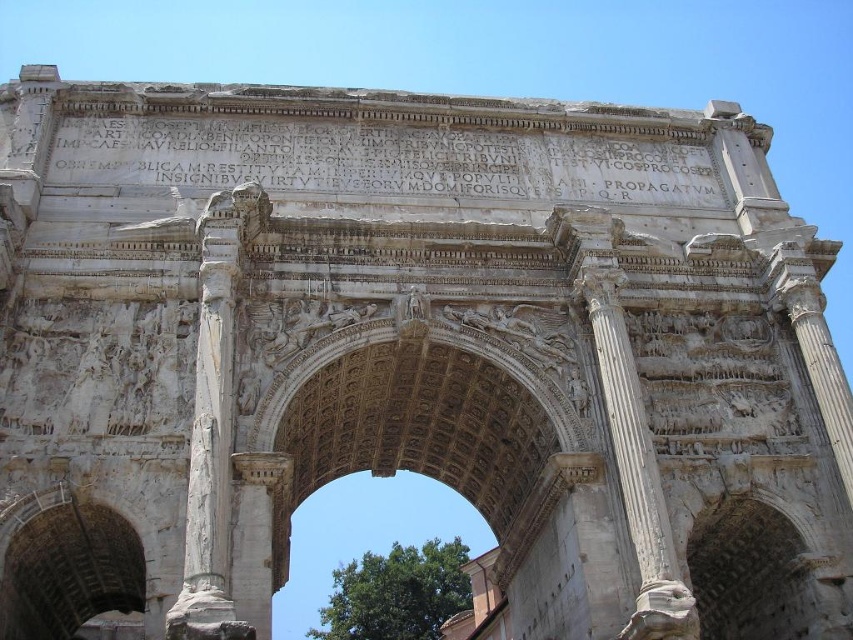
Question: Which point is closer to the camera taking this photo?

Choices:
 (A) (676, 563)
 (B) (199, 577)

Answer: (B)

Question: Which of the following is the farthest from the observer?

Choices:
 (A) (199, 627)
 (B) (637, 518)

Answer: (B)

Question: From the image, what is the correct spatial relationship of white marble column at left in relation to white marble column at center?

Choices:
 (A) above
 (B) below

Answer: (A)

Question: Does white marble column at left have a greater width compared to white marble column at center?

Choices:
 (A) no
 (B) yes

Answer: (B)

Question: Which of the following is the closest to the observer?

Choices:
 (A) white marble column at center
 (B) white marble column at left

Answer: (B)

Question: Is white marble column at left above white marble column at center?

Choices:
 (A) yes
 (B) no

Answer: (A)